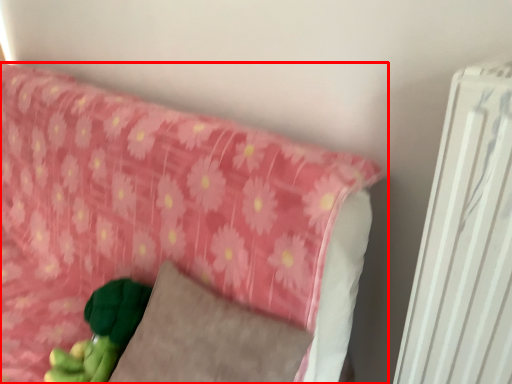
Question: From the image's perspective, where is furniture (annotated by the red box) located in relation to pillow in the image?

Choices:
 (A) below
 (B) above

Answer: (B)